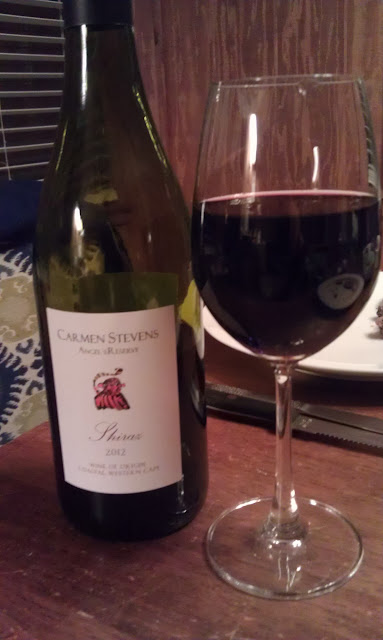
Find the location of a particular element. The height and width of the screenshot is (640, 383). wine bottle is located at coordinates (114, 244).